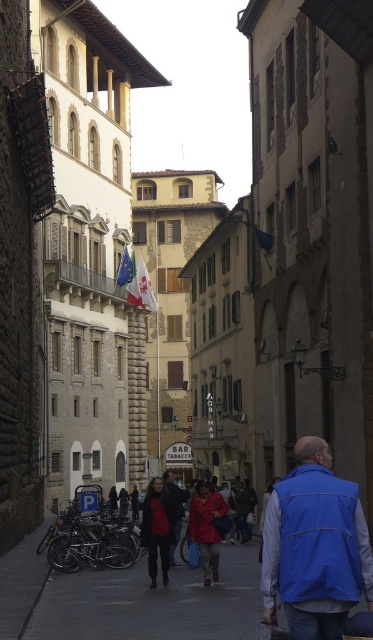
You are standing at the point marked by the coordinates (207,528) in the image. Looking around, you see a matte red coat at center. What is the nearest object to your current position?

The nearest object to the point marked by the coordinates (207,528) is the matte red coat at center.

You are a delivery person standing at the entrance of the street. You need to deliver a package to the person wearing the blue softshell vest at center and then to the person wearing the red leather jacket at center. Given that your delivery cart can only travel 60 meters before needing a recharge, can you complete both deliveries without recharging?

The distance between the blue softshell vest at center and the red leather jacket at center is 58.44 meters. Since the total distance required for both deliveries is 58.44 meters, which is under the 60 meters limit, you can complete both deliveries without needing to recharge.